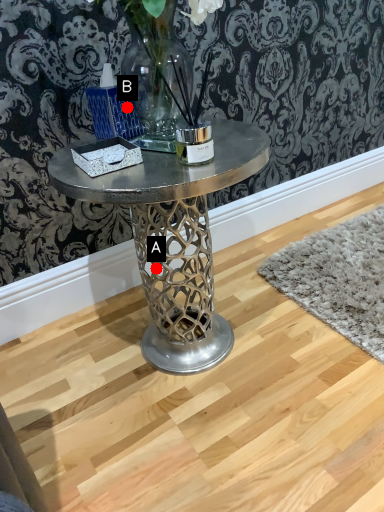
Question: Two points are circled on the image, labeled by A and B beside each circle. Which point appears closest to the camera in this image?

Choices:
 (A) A is closer
 (B) B is closer

Answer: (B)